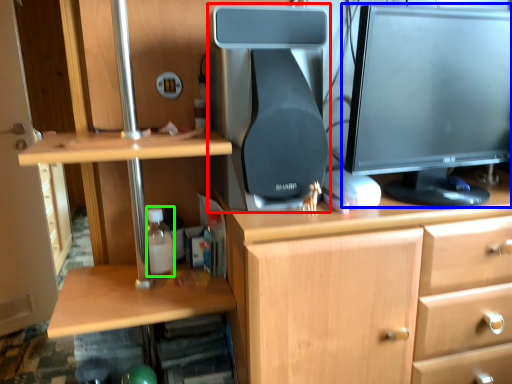
Question: Which is farther away from desktop computer (highlighted by a red box)? computer monitor (highlighted by a blue box) or bottle (highlighted by a green box)?

Choices:
 (A) computer monitor
 (B) bottle

Answer: (B)